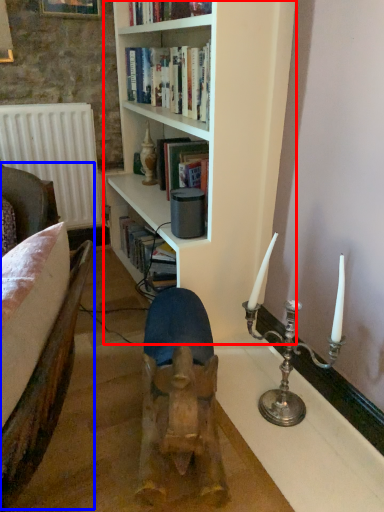
Question: Which point is further to the camera, bookcase (highlighted by a red box) or armchair (highlighted by a blue box)?

Choices:
 (A) bookcase
 (B) armchair

Answer: (A)